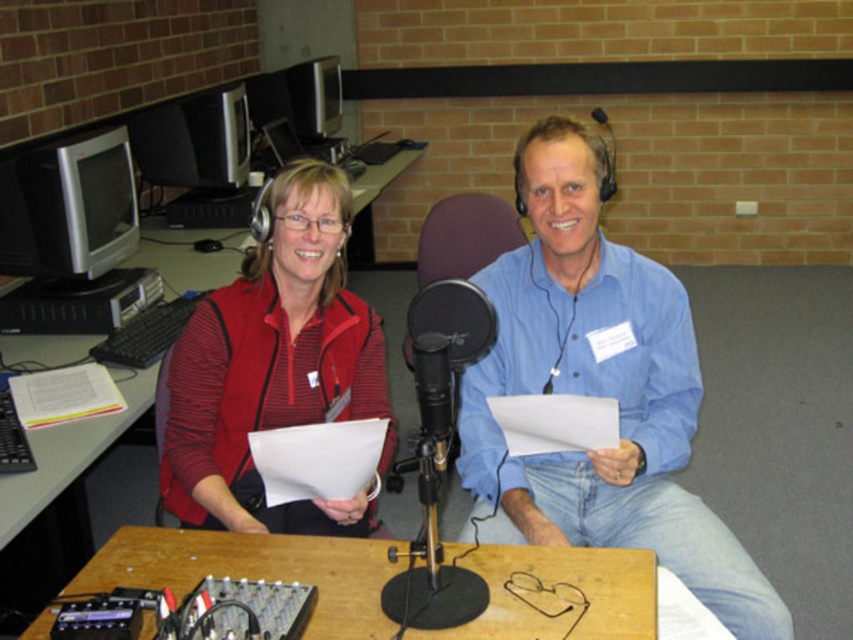
Question: Can you confirm if blue cotton shirt at center is bigger than red striped shirt at center?

Choices:
 (A) yes
 (B) no

Answer: (B)

Question: Which point is closer to the camera?

Choices:
 (A) (599, 116)
 (B) (753, 577)
 (C) (544, 554)
 (D) (265, 333)

Answer: (C)

Question: Can you confirm if red striped shirt at center is smaller than black matte microphone at upper center?

Choices:
 (A) no
 (B) yes

Answer: (A)

Question: Which point is farther to the camera?

Choices:
 (A) black matte microphone at upper center
 (B) blue cotton shirt at center
 (C) red striped shirt at center
 (D) wooden table at center

Answer: (A)

Question: Estimate the real-world distances between objects in this image. Which object is farther from the blue cotton shirt at center?

Choices:
 (A) red striped shirt at center
 (B) black matte microphone at upper center

Answer: (B)

Question: Can you confirm if blue cotton shirt at center is smaller than red striped shirt at center?

Choices:
 (A) yes
 (B) no

Answer: (A)